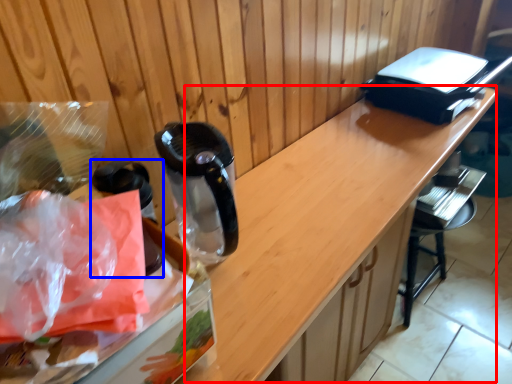
Question: Which point is closer to the camera, counter (highlighted by a red box) or appliance (highlighted by a blue box)?

Choices:
 (A) counter
 (B) appliance

Answer: (A)